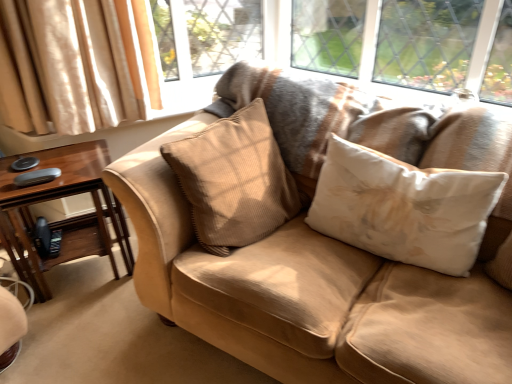
Question: Considering the positions of white fabric pillow at center, which is the first pillow from right to left, and suede couch at center in the image, is white fabric pillow at center, which is the first pillow from right to left, wider or thinner than suede couch at center?

Choices:
 (A) wide
 (B) thin

Answer: (B)

Question: Would you say white fabric pillow at center, which is the first pillow from right to left, is inside or outside suede couch at center?

Choices:
 (A) inside
 (B) outside

Answer: (A)

Question: Which object is positioned closest to the white fabric pillow at center, which is the first pillow from right to left?

Choices:
 (A) brown wood table at left
 (B) suede couch at center
 (C) beige corduroy pillow at center, which is the second pillow in right-to-left order

Answer: (B)

Question: Which of these objects is positioned farthest from the white fabric pillow at center, acting as the 2th pillow starting from the left?

Choices:
 (A) beige corduroy pillow at center, which is the second pillow in right-to-left order
 (B) suede couch at center
 (C) brown wood table at left

Answer: (C)